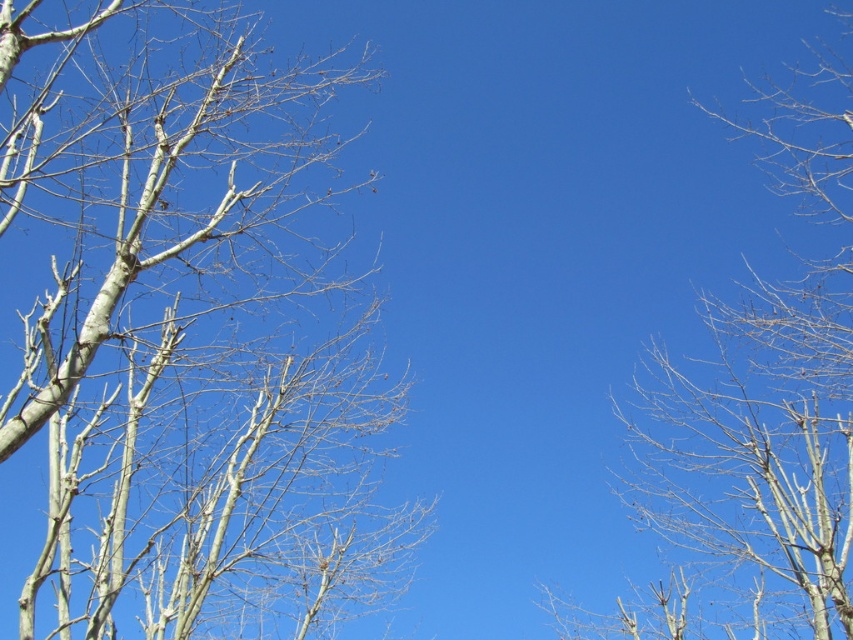
Question: Is white bark tree at left smaller than bare branches at right?

Choices:
 (A) yes
 (B) no

Answer: (B)

Question: Is white bark tree at left smaller than bare branches at right?

Choices:
 (A) no
 (B) yes

Answer: (A)

Question: Which object is farther from the camera taking this photo?

Choices:
 (A) bare branches at right
 (B) white bark tree at left

Answer: (A)

Question: Among these objects, which one is nearest to the camera?

Choices:
 (A) bare branches at right
 (B) white bark tree at left

Answer: (B)

Question: Does white bark tree at left appear under bare branches at right?

Choices:
 (A) yes
 (B) no

Answer: (A)